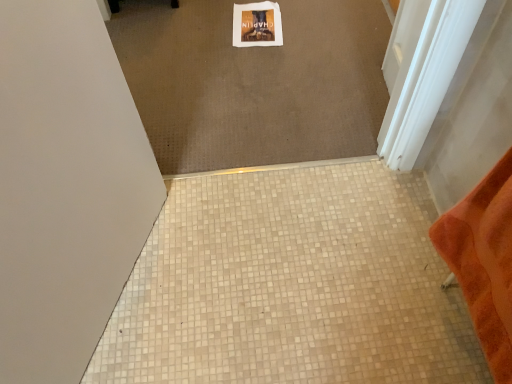
Question: Is white mosaic tile at center spatially inside white glossy screen door at upper right, or outside of it?

Choices:
 (A) inside
 (B) outside

Answer: (B)

Question: Considering their positions, is white mosaic tile at center located in front of or behind white glossy screen door at upper right?

Choices:
 (A) front
 (B) behind

Answer: (A)

Question: Looking at their shapes, would you say white mosaic tile at center is wider or thinner than white glossy screen door at upper right?

Choices:
 (A) wide
 (B) thin

Answer: (A)

Question: In the image, is white glossy screen door at upper right positioned in front of or behind white mosaic tile at center?

Choices:
 (A) behind
 (B) front

Answer: (A)

Question: Does point (425, 46) appear closer or farther from the camera than point (433, 289)?

Choices:
 (A) farther
 (B) closer

Answer: (B)

Question: Is white glossy screen door at upper right wider or thinner than white mosaic tile at center?

Choices:
 (A) thin
 (B) wide

Answer: (A)

Question: Considering the positions of white glossy screen door at upper right and white mosaic tile at center in the image, is white glossy screen door at upper right bigger or smaller than white mosaic tile at center?

Choices:
 (A) big
 (B) small

Answer: (B)